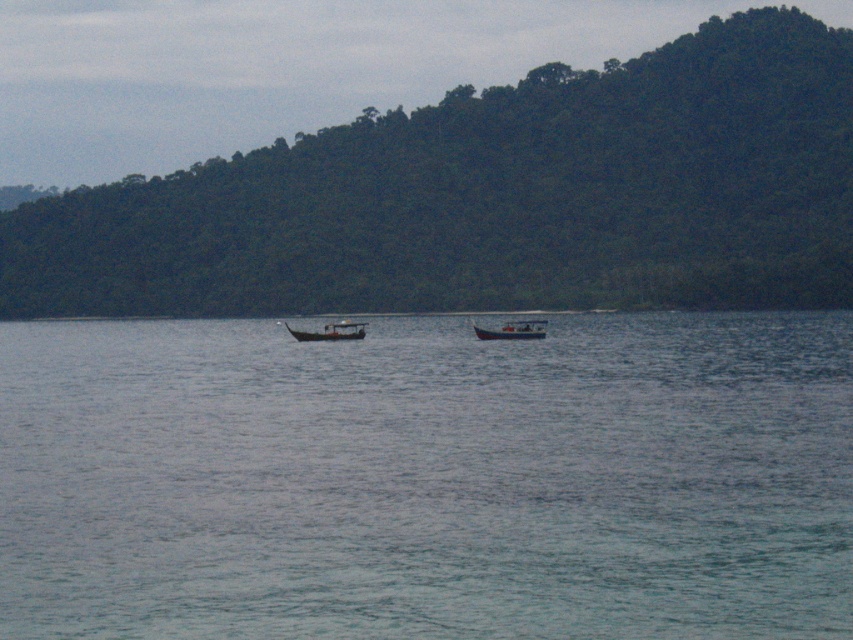
Can you confirm if green leafy hillside at upper center is positioned above wooden boat at center?

Indeed, green leafy hillside at upper center is positioned over wooden boat at center.

Which of these two, green leafy hillside at upper center or wooden boat at center, stands shorter?

wooden boat at center is shorter.

This screenshot has height=640, width=853. I want to click on green leafy hillside at upper center, so click(495, 196).

Who is higher up, white plastic boat at center or wooden boat at center?

white plastic boat at center is above.

Is white plastic boat at center wider than wooden boat at center?

Yes.

This screenshot has height=640, width=853. I want to click on white plastic boat at center, so pos(514,330).

Locate an element on the screen. This screenshot has height=640, width=853. white plastic boat at center is located at coordinates (514, 330).

Who is positioned more to the right, clear water at center or white plastic boat at center?

white plastic boat at center

Can you confirm if clear water at center is positioned to the right of white plastic boat at center?

Incorrect, clear water at center is not on the right side of white plastic boat at center.

What do you see at coordinates (428, 477) in the screenshot? I see `clear water at center` at bounding box center [428, 477].

Locate an element on the screen. This screenshot has height=640, width=853. clear water at center is located at coordinates (428, 477).